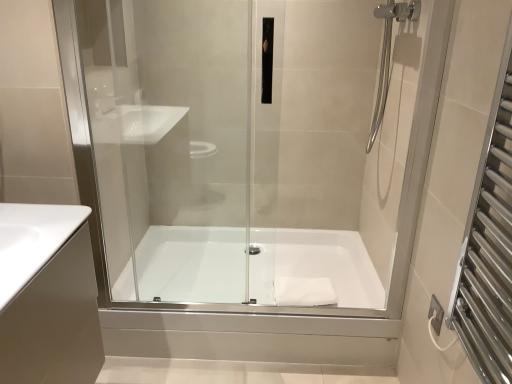
Question: From the image's perspective, would you say white glossy bathtub at center is shown under silver metallic towel rack at right?

Choices:
 (A) yes
 (B) no

Answer: (A)

Question: Is white glossy bathtub at center closer to the viewer compared to silver metallic towel rack at right?

Choices:
 (A) yes
 (B) no

Answer: (B)

Question: Is white glossy bathtub at center smaller than silver metallic towel rack at right?

Choices:
 (A) yes
 (B) no

Answer: (B)

Question: Is white glossy bathtub at center further to camera compared to silver metallic towel rack at right?

Choices:
 (A) no
 (B) yes

Answer: (B)

Question: Does white glossy bathtub at center appear on the right side of silver metallic towel rack at right?

Choices:
 (A) no
 (B) yes

Answer: (A)

Question: From a real-world perspective, is white glossy bathtub at center over silver metallic towel rack at right?

Choices:
 (A) no
 (B) yes

Answer: (A)

Question: Is white matte towel at center positioned with its back to transparent glass shower door at center?

Choices:
 (A) no
 (B) yes

Answer: (A)

Question: Considering the relative sizes of white matte towel at center and transparent glass shower door at center in the image provided, is white matte towel at center wider than transparent glass shower door at center?

Choices:
 (A) yes
 (B) no

Answer: (A)

Question: Is the surface of white matte towel at center in direct contact with transparent glass shower door at center?

Choices:
 (A) yes
 (B) no

Answer: (B)

Question: From a real-world perspective, is white matte towel at center below transparent glass shower door at center?

Choices:
 (A) yes
 (B) no

Answer: (A)

Question: Is white matte towel at center further to camera compared to transparent glass shower door at center?

Choices:
 (A) no
 (B) yes

Answer: (B)

Question: From the image's perspective, is white matte towel at center located above transparent glass shower door at center?

Choices:
 (A) yes
 (B) no

Answer: (B)

Question: Is transparent glass shower door at center to the left of silver metallic towel rack at right from the viewer's perspective?

Choices:
 (A) no
 (B) yes

Answer: (B)